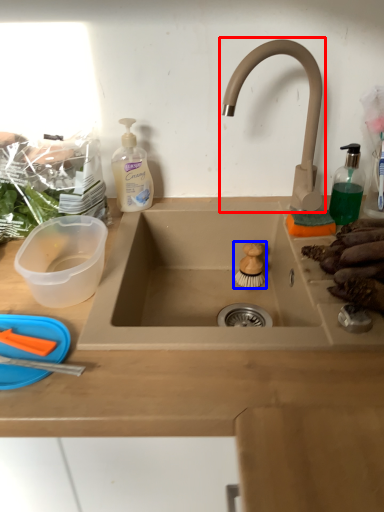
Question: Among these objects, which one is farthest to the camera, tap (highlighted by a red box) or food (highlighted by a blue box)?

Choices:
 (A) tap
 (B) food

Answer: (B)